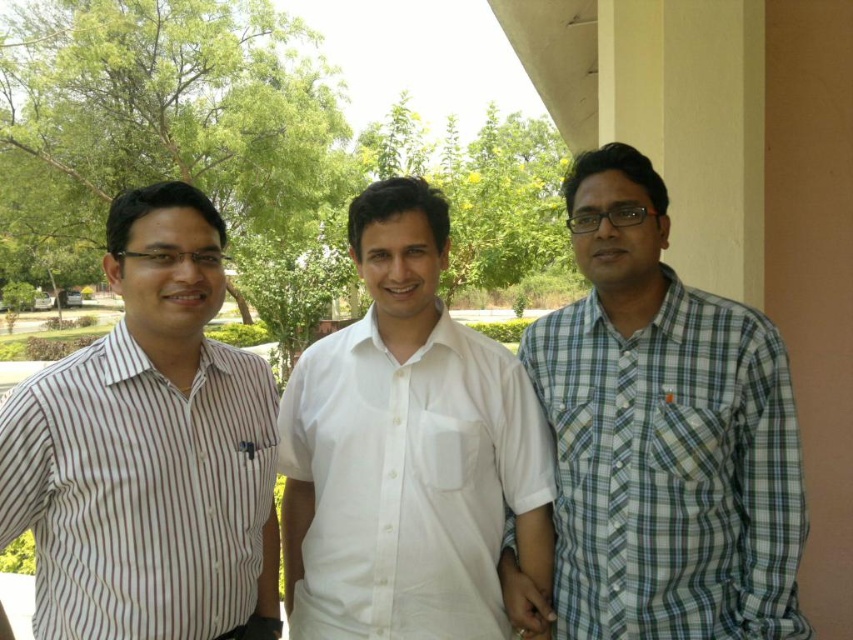
Who is lower down, checkered fabric shirt at right or white cotton shirt at center?

white cotton shirt at center is lower down.

Between point (639, 221) and point (308, 596), which one is positioned in front?

Point (639, 221) is in front.

Identify the location of checkered fabric shirt at right. This screenshot has width=853, height=640. (659, 440).

In the scene shown: Who is more forward, (x=207, y=545) or (x=421, y=582)?

Point (x=207, y=545) is in front.

The width and height of the screenshot is (853, 640). I want to click on white striped shirt at left, so click(149, 451).

Does checkered fabric shirt at right have a greater width compared to white striped shirt at left?

Yes.

Image resolution: width=853 pixels, height=640 pixels. What do you see at coordinates (659, 440) in the screenshot? I see `checkered fabric shirt at right` at bounding box center [659, 440].

Who is more distant from viewer, (637, 236) or (84, 349)?

The point (637, 236) is more distant.

Locate an element on the screen. checkered fabric shirt at right is located at coordinates (659, 440).